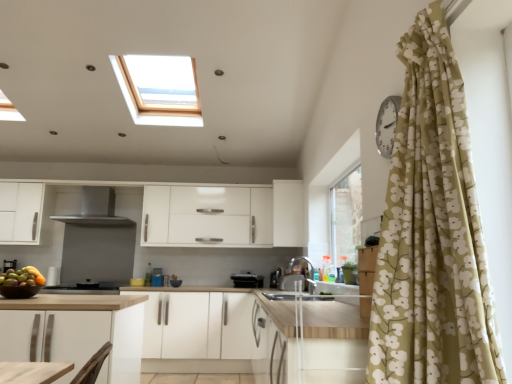
Question: Considering the positions of satin black coffee machine at lower left and satin black toaster at center, which ranks as the sixth appliance in front-to-back order, in the image, is satin black coffee machine at lower left wider or thinner than satin black toaster at center, which ranks as the sixth appliance in front-to-back order,?

Choices:
 (A) thin
 (B) wide

Answer: (B)

Question: Relative to satin black toaster at center, which ranks as the sixth appliance in front-to-back order, is satin black coffee machine at lower left in front or behind?

Choices:
 (A) behind
 (B) front

Answer: (B)

Question: Which of these objects is positioned closest to the satin silver sink at center, the 4th appliance positioned from the bottom?

Choices:
 (A) white matte cabinet at center, which appears as the 1th cabinetry when viewed from the right
 (B) metallic faucet at center, which is the 2th appliance from front to back
 (C) black plastic toaster at center, which appears as the third appliance when ordered from the bottom
 (D) wooden countertop at lower left
 (E) satin black coffee machine at lower left

Answer: (B)

Question: Estimate the real-world distances between objects in this image. Which object is closer to the black matte stove at lower center, acting as the 3th appliance starting from the back?

Choices:
 (A) black plastic toaster at center, the second appliance positioned from the back
 (B) silver metallic clock at upper right, the first appliance from the right
 (C) metallic faucet at center, which is the 2th appliance from front to back
 (D) white matte cabinet at center, which is counted as the first cabinetry, starting from the top
 (E) shiny brown bowl of fruits at lower left

Answer: (E)